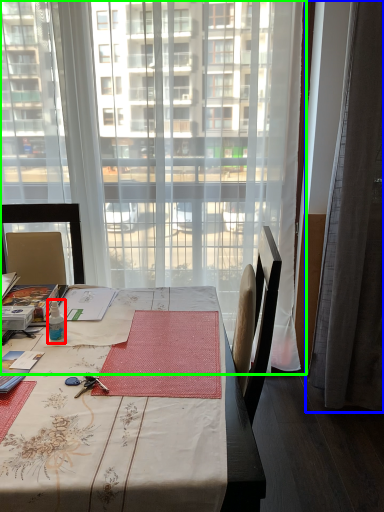
Question: Which is nearer to the bottle (highlighted by a red box)? curtain (highlighted by a blue box) or window (highlighted by a green box).

Choices:
 (A) curtain
 (B) window

Answer: (B)